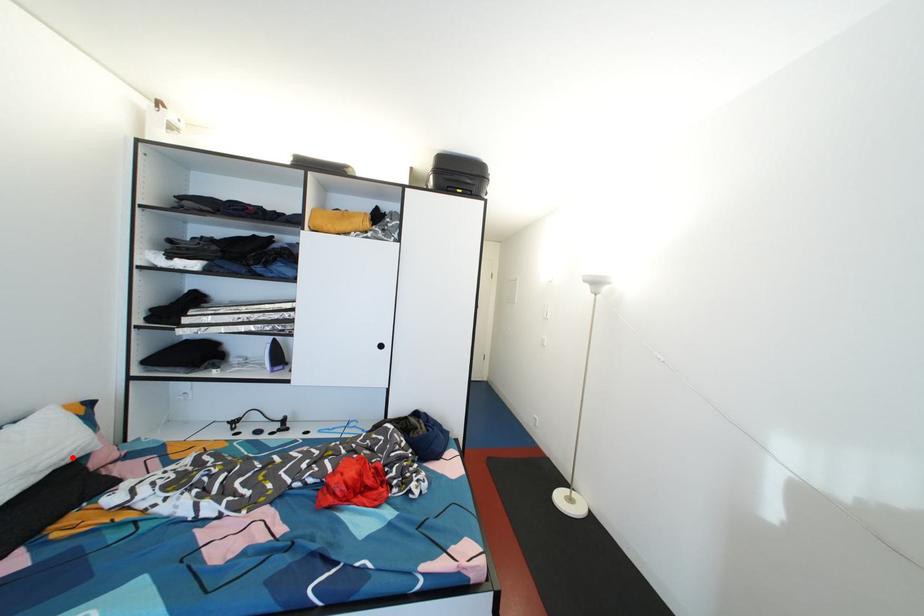
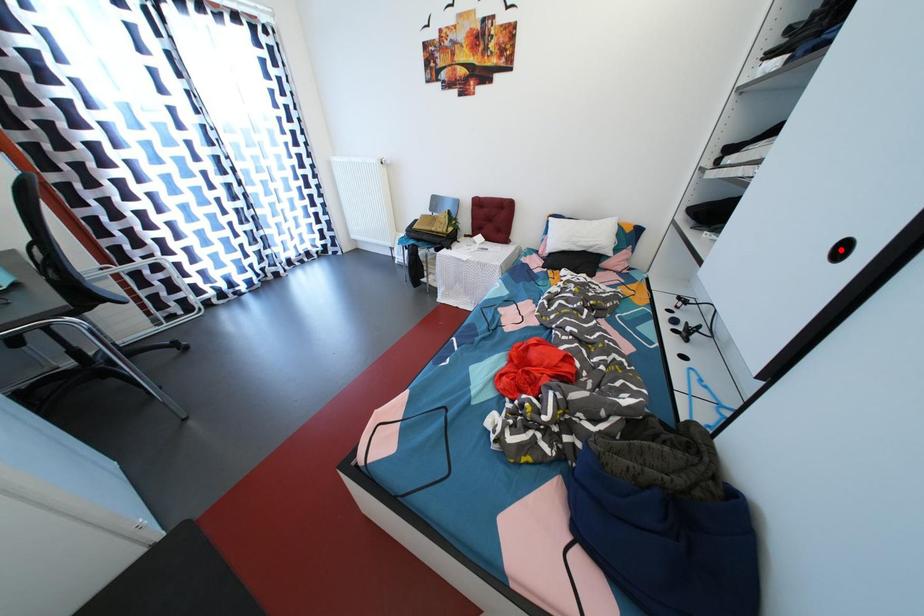
I am providing you with two images of the same scene from different viewpoints. A red point is marked on the first image and another point is marked on the second image. Does the point marked in image1 correspond to the same location as the one in image2?

No